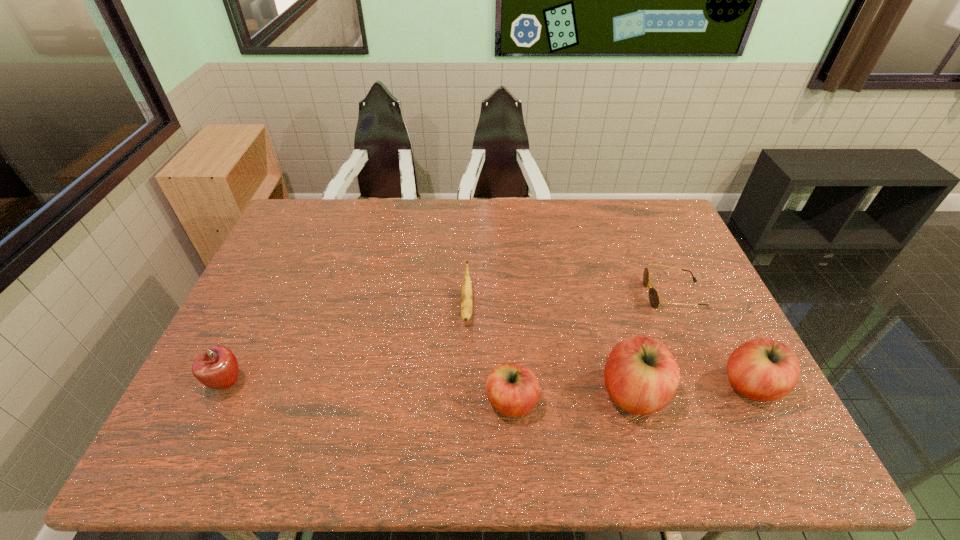
The height and width of the screenshot is (540, 960). What are the coordinates of `free space that satisfies the following two spatial constraints: 1. on the peel of the second shortest object from the top; 2. on the right side of the third apple from left to right` in the screenshot? It's located at (465, 393).

This screenshot has width=960, height=540. In order to click on free space that satisfies the following two spatial constraints: 1. on the peel of the rightmost apple from the top; 2. on the left side of the banana in this screenshot , I will do `click(465, 385)`.

This screenshot has width=960, height=540. Identify the location of free location that satisfies the following two spatial constraints: 1. on the front-facing side of the shortest object; 2. on the left side of the fifth shortest object. (713, 385).